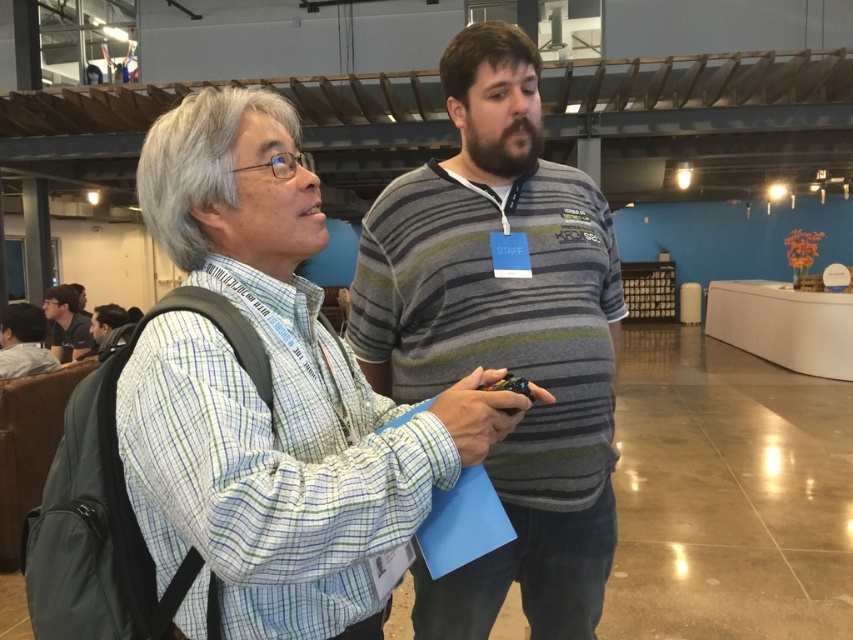
You are organizing a photo shoot and need to place a small prop between the plaid shirt at center and the dark gray shirt at lower left. Based on their sizes, which shirt would you place the prop closer to?

The plaid shirt at center occupies less space than the dark gray shirt at lower left, so the prop should be placed closer to the plaid shirt at center to balance the composition.

You are trying to determine the order of layers in a clothing arrangement. You see a plaid shirt at center and a striped cotton shirt at center. Which one is covering the other?

The plaid shirt at center is positioned over striped cotton shirt at center, so it is covering the striped cotton shirt at center.